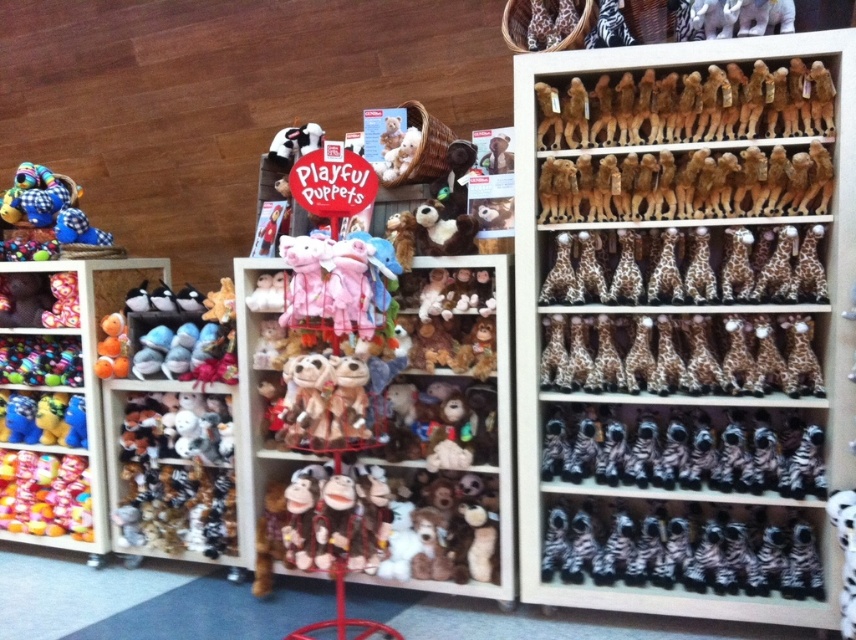
Question: Among these points, which one is nearest to the camera?

Choices:
 (A) (593, 102)
 (B) (76, 369)
 (C) (56, 481)
 (D) (342, 164)

Answer: (D)

Question: Which point is closer to the camera?

Choices:
 (A) translucent plastic candy at lower left
 (B) spotted brown plush at center
 (C) brown plush giraffes at right
 (D) zebra-striped plush at right

Answer: (C)

Question: Does spotted brown plush at center appear over multicolored fabric balls at lower left?

Choices:
 (A) yes
 (B) no

Answer: (A)

Question: From the image, what is the correct spatial relationship of brown plush giraffes at right in relation to white cardboard sign at center?

Choices:
 (A) right
 (B) left

Answer: (A)

Question: Which point is closer to the camera?

Choices:
 (A) spotted brown plush at center
 (B) multicolored plush toys at left
 (C) zebra-striped plush at right
 (D) translucent plastic candy at lower left

Answer: (A)

Question: In this image, where is soft plush toys at center located relative to spotted brown plush at center?

Choices:
 (A) right
 (B) left

Answer: (B)